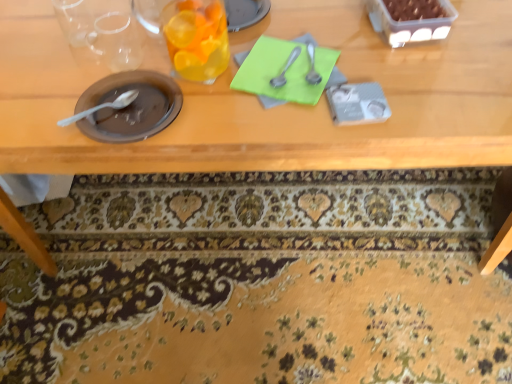
Question: Which is correct: matte brown plate at left, the first tableware viewed from the left, is inside translucent glass at upper center, the second tableware when ordered from left to right, or outside of it?

Choices:
 (A) inside
 (B) outside

Answer: (B)

Question: Visually, is matte brown plate at left, the first tableware viewed from the left, positioned to the left or to the right of translucent glass at upper center, the second tableware when ordered from left to right?

Choices:
 (A) right
 (B) left

Answer: (B)

Question: Estimate the real-world distances between objects in this image. Which object is farther from the wooden table at center?

Choices:
 (A) green paper at center
 (B) satin silver spoon at upper center, the 4th tableware when ordered from left to right
 (C) translucent glass at upper center, the second tableware when ordered from left to right
 (D) matte brown plate at left, the first tableware viewed from the left
 (E) satin silver spoon at center, positioned as the third tableware in left-to-right order

Answer: (B)

Question: Considering the real-world distances, which object is closest to the green paper at center?

Choices:
 (A) floral carpet at lower center
 (B) translucent glass at upper center, the second tableware when ordered from left to right
 (C) satin silver spoon at upper center, the 4th tableware when ordered from left to right
 (D) matte brown plate at left, the fourth tableware viewed from the right
 (E) satin silver spoon at center, which is the second tableware from right to left

Answer: (E)